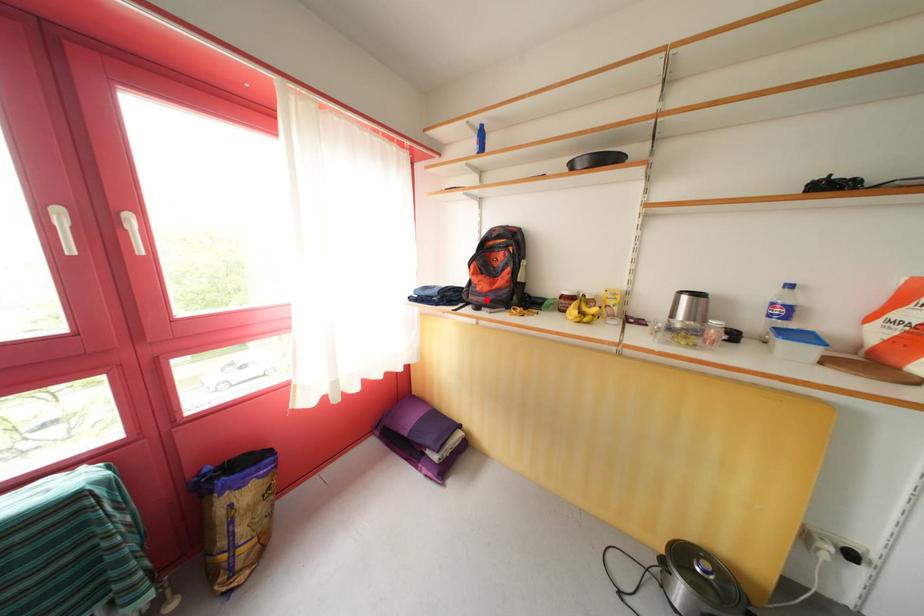
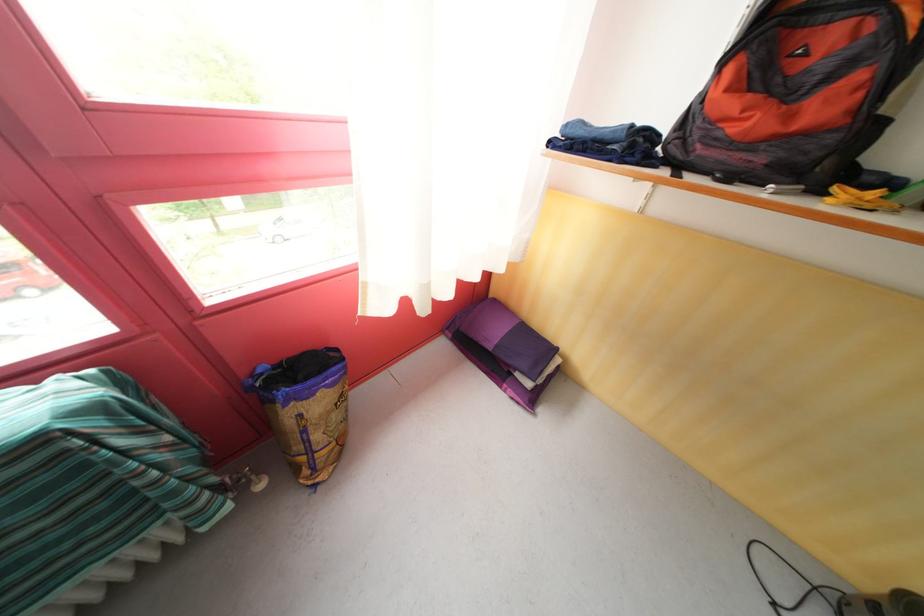
Where in the second image is the point corresponding to the highlighted location from the first image?

(736, 151)